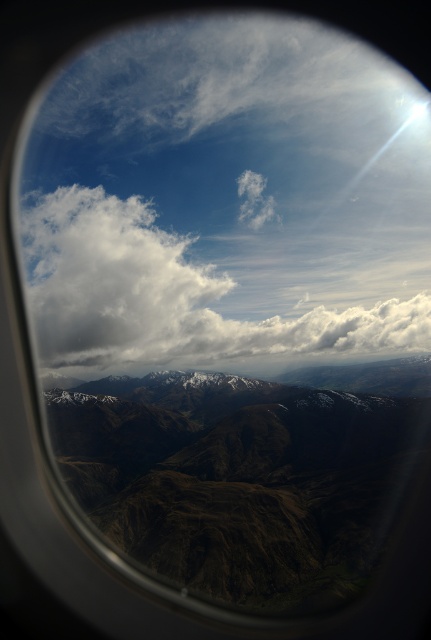
Which is above, brown textured mountain range at center or white fluffy cloud at upper center?

white fluffy cloud at upper center is above.

Is brown textured mountain range at center wider than white fluffy cloud at upper center?

No, brown textured mountain range at center is not wider than white fluffy cloud at upper center.

Is point (180, 563) more distant than point (193, 298)?

No, (180, 563) is in front of (193, 298).

At what (x,y) coordinates should I click in order to perform the action: click on brown textured mountain range at center. Please return your answer as a coordinate pair (x, y). The height and width of the screenshot is (640, 431). Looking at the image, I should click on (246, 474).